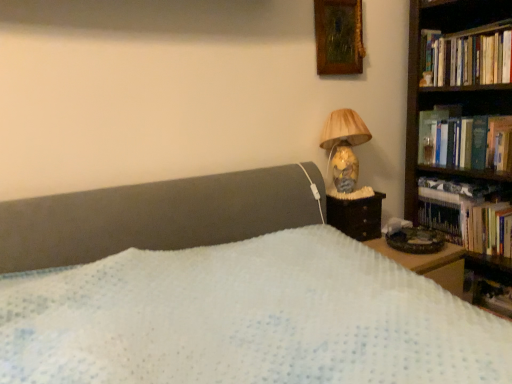
Question: Looking at their shapes, would you say hardcover book at upper right is wider or thinner than hardcover book at right, positioned as the second book in top-to-bottom order?

Choices:
 (A) wide
 (B) thin

Answer: (A)

Question: From a real-world perspective, is hardcover book at upper right above or below hardcover book at right, positioned as the second book in top-to-bottom order?

Choices:
 (A) below
 (B) above

Answer: (B)

Question: Estimate the real-world distances between objects in this image. Which object is farther from the wooden framed painting at upper right?

Choices:
 (A) hardcover books at right, which is the third book in bottom-to-top order
 (B) matte yellow lampshade at upper right
 (C) dark wood nightstand at right
 (D) hardcover book at upper right
 (E) wooden bookshelf at right

Answer: (E)

Question: Based on their relative distances, which object is farther from the wooden bookshelf at right?

Choices:
 (A) hardcover books at right, which appears as the first book when ordered from the bottom
 (B) hardcover books at right, which is the third book in bottom-to-top order
 (C) hardcover book at upper right
 (D) matte yellow lampshade at upper right
 (E) dark wood nightstand at right

Answer: (B)